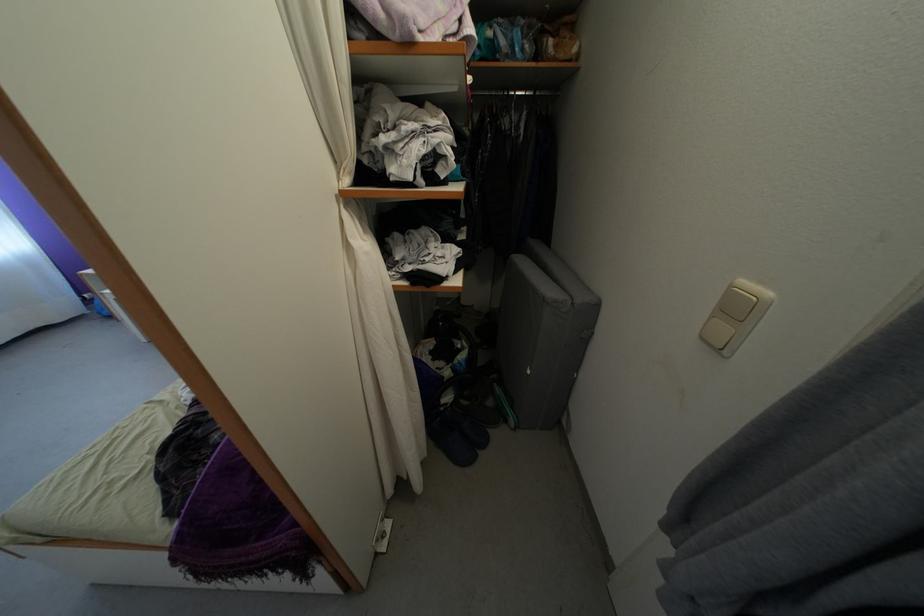
Find where to lift the blue shoe. Please return your answer as a coordinate pair (x, y).

(451, 442)